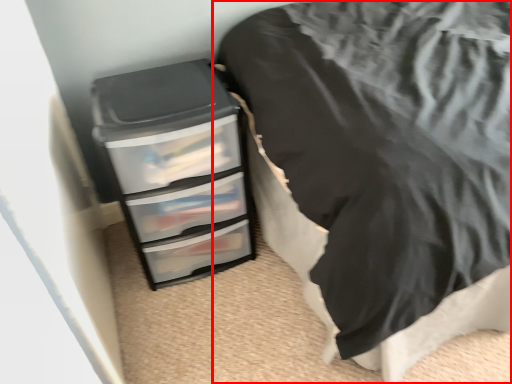
Question: From the image's perspective, considering the relative positions of furniture (annotated by the red box) and chest of drawers in the image provided, where is furniture (annotated by the red box) located with respect to the staircase?

Choices:
 (A) above
 (B) below

Answer: (A)